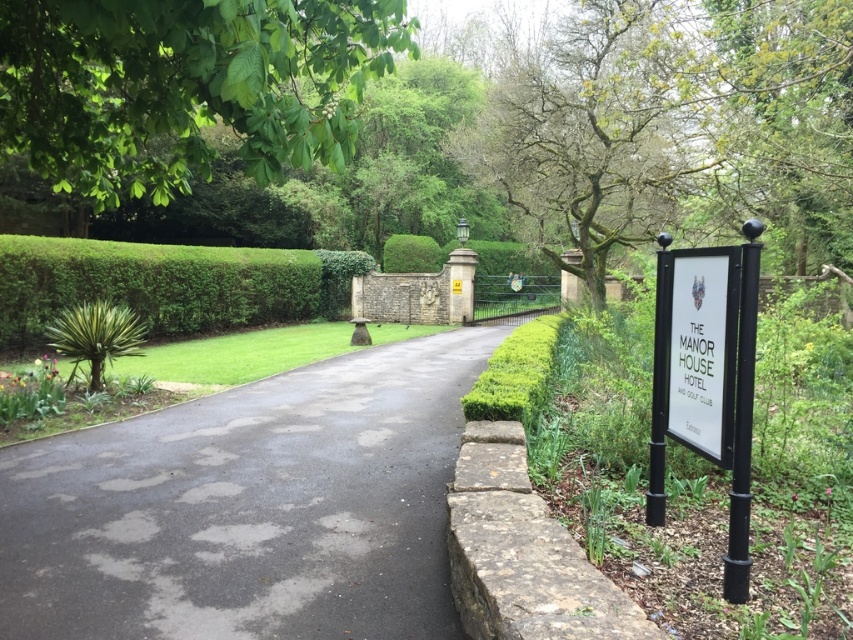
Question: From the image, what is the correct spatial relationship of dark gray asphalt at center in relation to green leafy tree at upper left?

Choices:
 (A) above
 (B) below

Answer: (B)

Question: Which point is farther from the camera taking this photo?

Choices:
 (A) (688, 353)
 (B) (77, 177)
 (C) (117, 540)
 (D) (318, 292)

Answer: (D)

Question: Which point is farther from the camera taking this photo?

Choices:
 (A) (175, 3)
 (B) (729, 324)

Answer: (B)

Question: Is dark gray asphalt at center smaller than green leafy tree at upper left?

Choices:
 (A) no
 (B) yes

Answer: (B)

Question: Is dark gray asphalt at center below green leafy tree at upper left?

Choices:
 (A) yes
 (B) no

Answer: (A)

Question: Considering the real-world distances, which object is closest to the green leafy tree at upper left?

Choices:
 (A) green leafy hedge at center
 (B) white paper sign at right

Answer: (B)